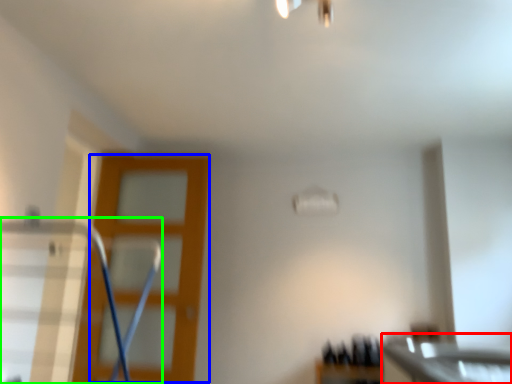
Question: Estimate the real-world distances between objects in this image. Which object is farther from counter top (highlighted by a red box), screen door (highlighted by a blue box) or swivel chair (highlighted by a green box)?

Choices:
 (A) screen door
 (B) swivel chair

Answer: (B)